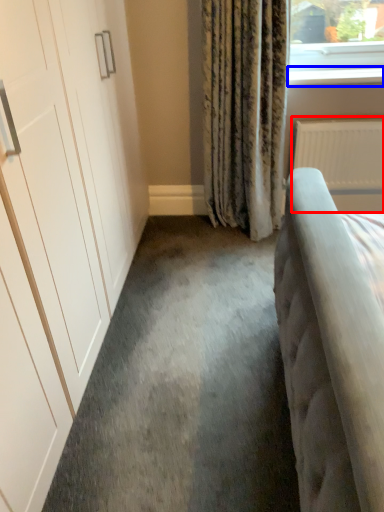
Question: Which object appears closest to the camera in this image, radiator (highlighted by a red box) or window sill (highlighted by a blue box)?

Choices:
 (A) radiator
 (B) window sill

Answer: (B)